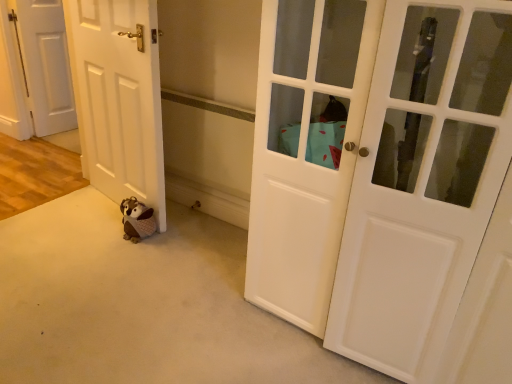
Image resolution: width=512 pixels, height=384 pixels. Identify the location of vacant space in front of plush brown bear at lower left. (126, 256).